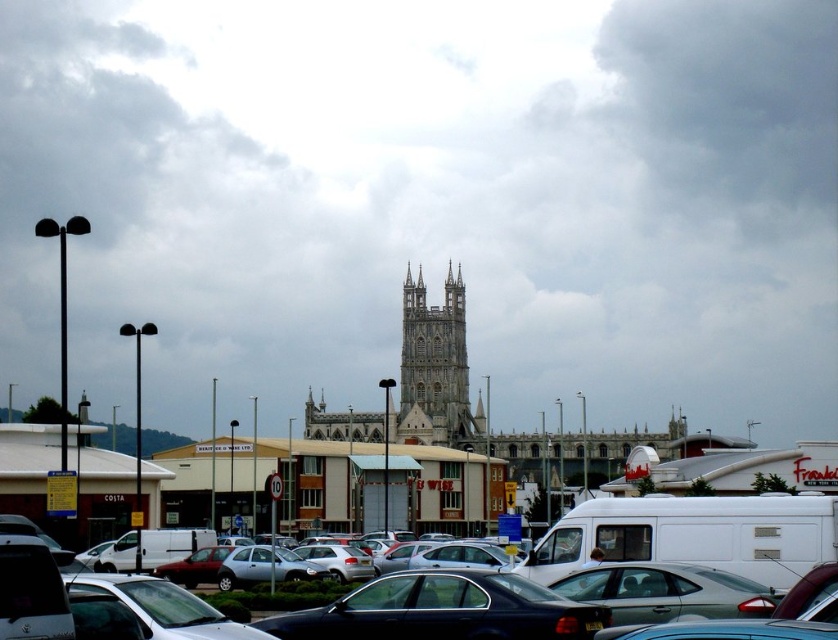
Question: Considering the real-world distances, which object is farthest from the silver metallic sedan at center?

Choices:
 (A) metallic silver sedan at center
 (B) white stone tower at center

Answer: (B)

Question: Which of these objects is positioned farthest from the white stone tower at center?

Choices:
 (A) silver metallic sedan at center
 (B) metallic silver sedan at center

Answer: (B)

Question: Which of the following is the farthest from the observer?

Choices:
 (A) (443, 364)
 (B) (628, 595)

Answer: (A)

Question: Does white stone tower at center have a lesser width compared to metallic silver sedan at center?

Choices:
 (A) yes
 (B) no

Answer: (A)

Question: Does silver metallic sedan at center appear on the left side of metallic silver sedan at center?

Choices:
 (A) yes
 (B) no

Answer: (A)

Question: Is white stone tower at center bigger than metallic silver sedan at center?

Choices:
 (A) yes
 (B) no

Answer: (A)